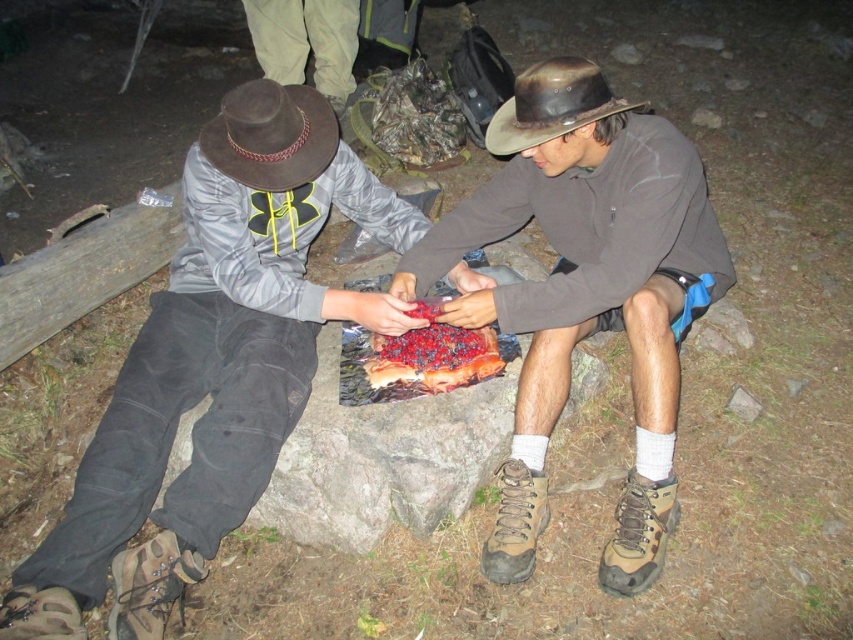
Question: Which of the following is the closest to the observer?

Choices:
 (A) brown suede cowboy hat at upper left
 (B) brown leather hat at center

Answer: (B)

Question: Is brown leather cowboy hat at center below brown suede hiking boot at lower center?

Choices:
 (A) no
 (B) yes

Answer: (A)

Question: Considering the real-world distances, which object is farthest from the brown leather cowboy hat at center?

Choices:
 (A) red berry-topped bread at center
 (B) matte gray jacket at center

Answer: (B)

Question: Which object is the closest to the brown leather cowboy hat at center?

Choices:
 (A) tan suede hiking boot at lower right
 (B) brown leather boot at lower left
 (C) brown suede hiking boot at lower center

Answer: (C)

Question: Is brown leather cowboy hat at center behind brown leather boot at lower left?

Choices:
 (A) no
 (B) yes

Answer: (B)

Question: From the image, what is the correct spatial relationship of brown leather cowboy hat at center in relation to brown leather boot at lower left?

Choices:
 (A) above
 (B) below

Answer: (A)